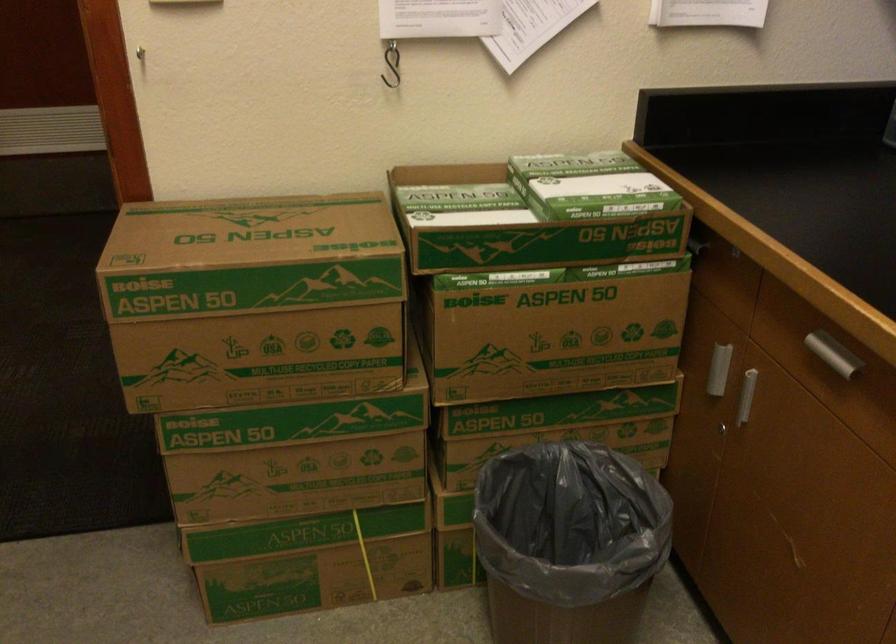
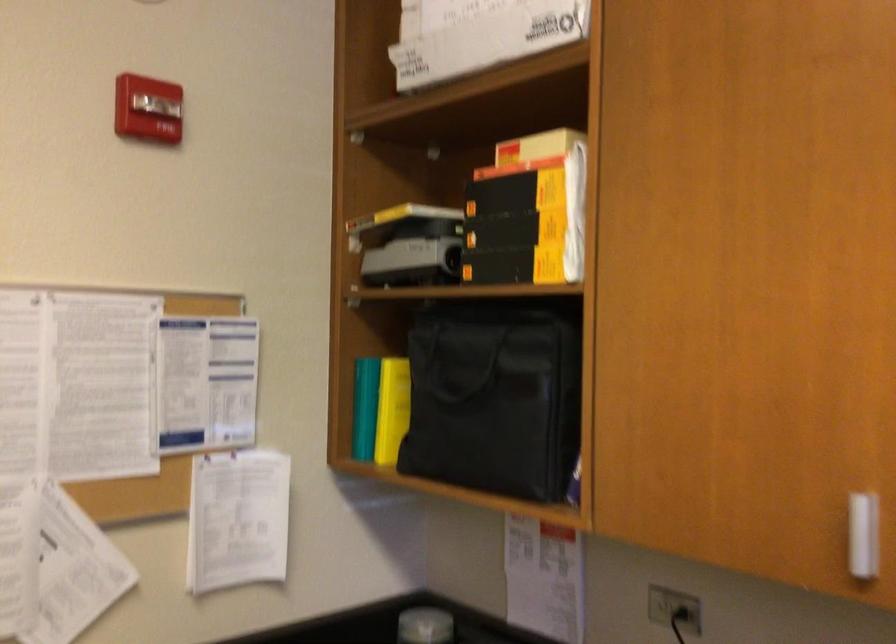
Based on the continuous images, in which direction is the camera rotating?

The rotation direction of the camera is right-up.